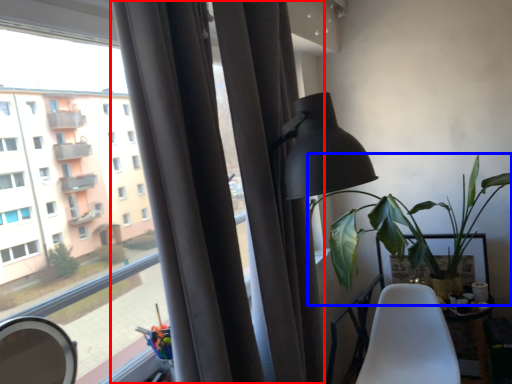
Question: Which of the following is the farthest to the observer, curtain (highlighted by a red box) or houseplant (highlighted by a blue box)?

Choices:
 (A) curtain
 (B) houseplant

Answer: (B)